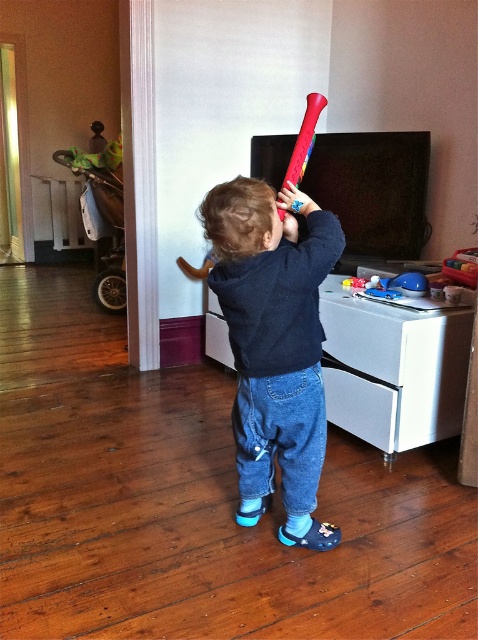
You are a parent trying to organize toys in the playroom. You see the matte plastic bat at center and the rubberized red baseball bat at upper center. Which bat should you move to the lower shelf if you want to place them in order from top to bottom?

You should move the matte plastic bat at center to the lower shelf because it is already positioned under the rubberized red baseball bat at upper center, so placing it lower maintains their current vertical arrangement.

The child is holding a matte plastic bat at center. The stroller and baby carrier are visible through an open doorway to the left. If the child wants to walk from the current position to the stroller and baby carrier, will they have enough space to move freely? Please explain.

The distance between the child holding the matte plastic bat at center and the stroller and baby carrier through the open doorway to the left is 1.48 meters. Since this distance is sufficient for a child to move freely, they should have enough space.

You are a parent trying to hand your child a bat. You have both the matte plastic bat at center and the rubberized red baseball bat at upper center. Which bat should you hand to the child first if you want to give them the one closer to you?

The matte plastic bat at center is closer to the viewer than the rubberized red baseball bat at upper center, so you should hand the matte plastic bat at center to the child first.